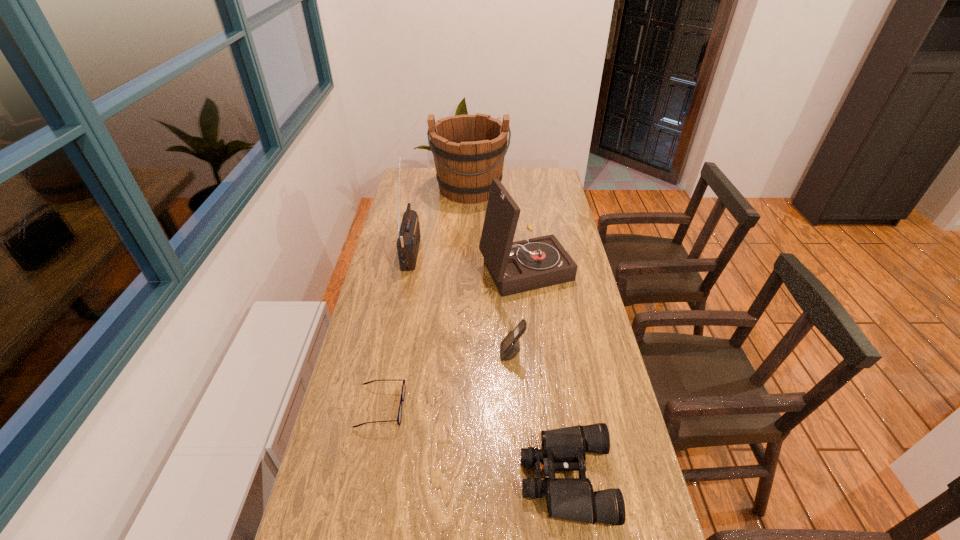
The width and height of the screenshot is (960, 540). Find the location of `vacant area that lies between the radio receiver and the second shortest object`. vacant area that lies between the radio receiver and the second shortest object is located at coordinates (489, 364).

Locate an element on the screen. This screenshot has width=960, height=540. vacant space that is in between the binoculars and the fifth farthest object is located at coordinates (473, 442).

You are a GUI agent. You are given a task and a screenshot of the screen. Output one action in this format:
    pyautogui.click(x=<x>, y=<y>)
    Task: Click on the vacant space that's between the radio receiver and the wine bucket
    
    Given the screenshot: What is the action you would take?
    441,219

Locate an element on the screen. Image resolution: width=960 pixels, height=540 pixels. vacant space that's between the binoculars and the radio receiver is located at coordinates (489, 364).

This screenshot has width=960, height=540. In order to click on vacant area that lies between the cellular telephone and the fifth farthest object in this screenshot , I will do `click(446, 380)`.

Identify the location of blank region between the radio receiver and the spectacles. (396, 328).

This screenshot has width=960, height=540. What are the coordinates of `vacant space that's between the phonograph record and the nearest object` in the screenshot? It's located at (546, 372).

I want to click on free space between the radio receiver and the cellular telephone, so click(462, 302).

Find the location of a particular element. The image size is (960, 540). object that ranks as the third closest to the third nearest object is located at coordinates (399, 417).

Point out which object is positioned as the second nearest to the nearest object. Please provide its 2D coordinates. Your answer should be formatted as a tuple, i.e. [(x, y)], where the tuple contains the x and y coordinates of a point satisfying the conditions above.

[(399, 417)]